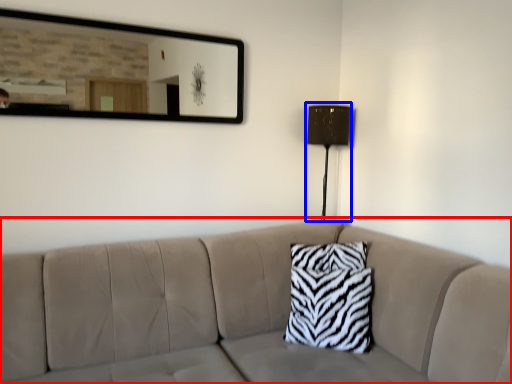
Question: Which object is closer to the camera taking this photo, studio couch (highlighted by a red box) or table lamp (highlighted by a blue box)?

Choices:
 (A) studio couch
 (B) table lamp

Answer: (A)